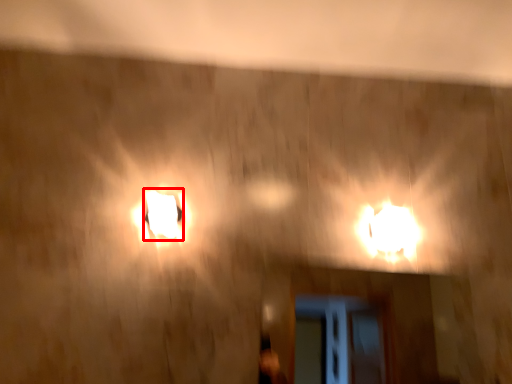
Question: From the image's perspective, where is lamp (annotated by the red box) located relative to lamp?

Choices:
 (A) above
 (B) below

Answer: (A)